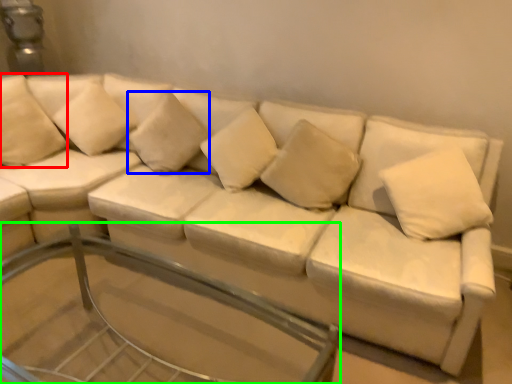
Question: Which object is the farthest from pillow (highlighted by a red box)? Choose among these: pillow (highlighted by a blue box) or glass table (highlighted by a green box).

Choices:
 (A) pillow
 (B) glass table

Answer: (B)